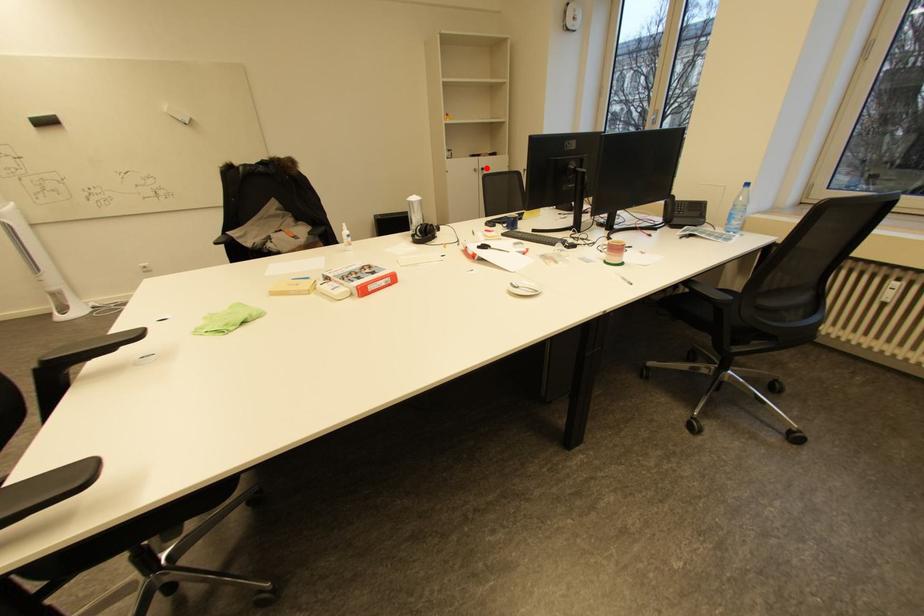
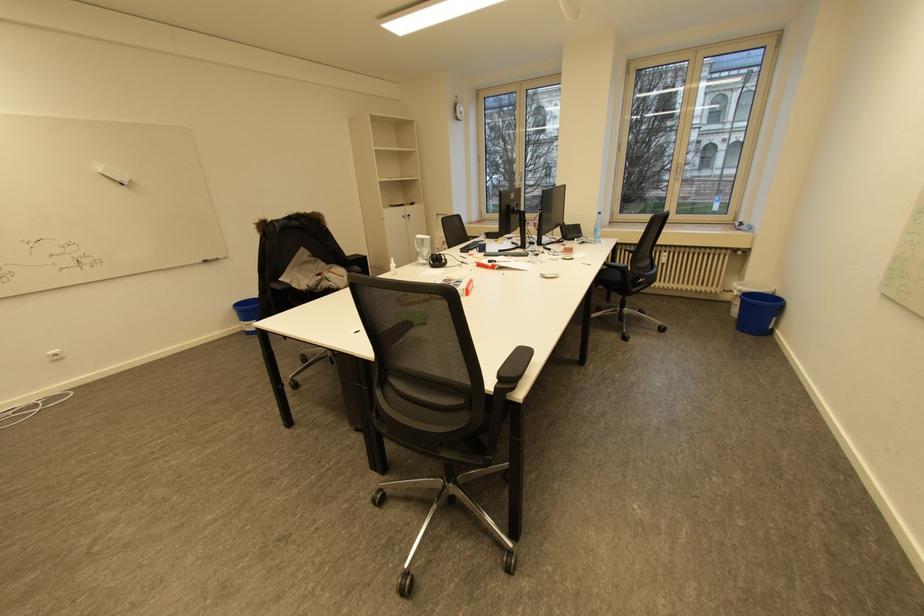
Where in the second image is the point corresponding to the highlighted location from the first image?

(412, 215)